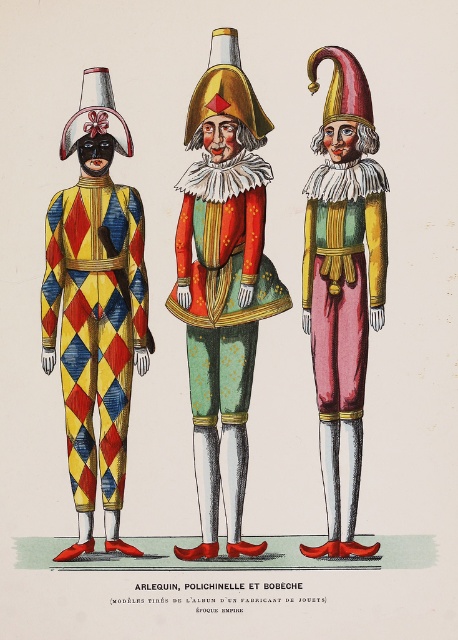
You are a costume designer preparing for a play and need to ensure the matte gold and red costume at center and the matte gold jester hat at center are proportionate. Based on the image, which object is bigger?

The matte gold and red costume at center is larger in size compared to the matte gold jester hat at center.